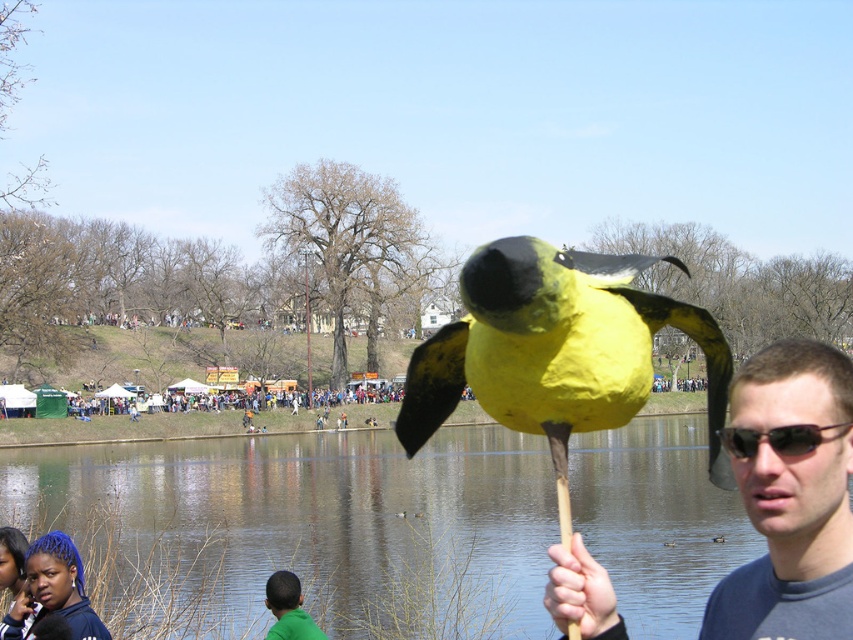
Is point (404, 566) farther from camera compared to point (265, 598)?

Yes, it is.

Between clear water at lake center and green matte shirt at lower center, which one has less height?

green matte shirt at lower center is shorter.

Which is behind, point (258, 456) or point (285, 621)?

The point (258, 456) is more distant.

Find the location of `clear water at lake center`. clear water at lake center is located at coordinates (318, 515).

Who is more forward, (692, 512) or (753, 448)?

Point (753, 448) is more forward.

Does point (396, 472) lie behind point (721, 436)?

That is True.

I want to click on clear water at lake center, so click(318, 515).

Is point (257, 445) farther from viewer compared to point (553, 330)?

Yes, it is.

Is clear water at lake center to the left of yellow paper bird at center from the viewer's perspective?

Yes, clear water at lake center is to the left of yellow paper bird at center.

Consider the image. Who is more forward, (318, 499) or (724, 385)?

Point (724, 385)

At what (x,y) coordinates should I click in order to perform the action: click on clear water at lake center. Please return your answer as a coordinate pair (x, y). Looking at the image, I should click on (318, 515).